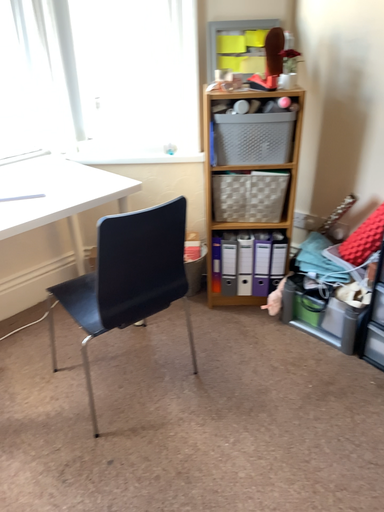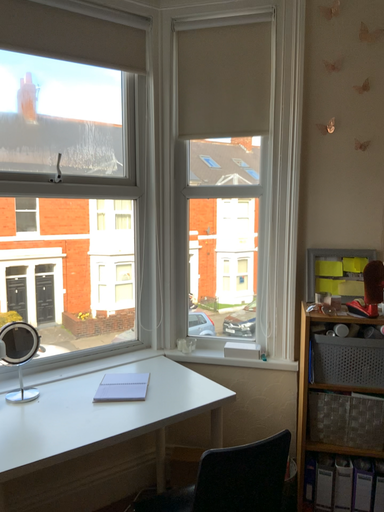
Question: Which way did the camera rotate in the video?

Choices:
 (A) rotated right
 (B) rotated left

Answer: (B)